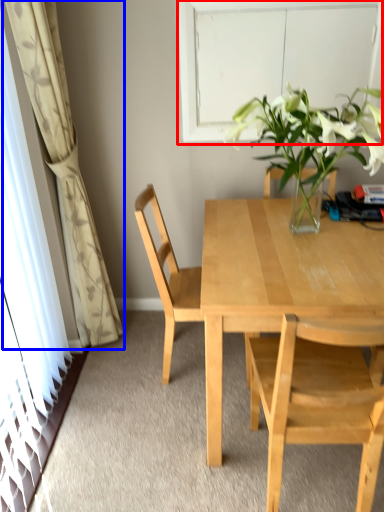
Question: Which of the following is the closest to the observer, window (highlighted by a red box) or curtain (highlighted by a blue box)?

Choices:
 (A) window
 (B) curtain

Answer: (B)